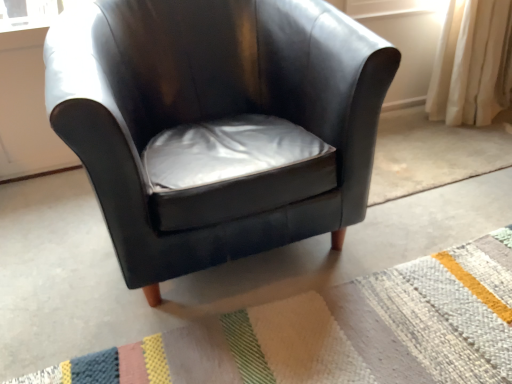
Question: Does textured woolen mat at lower right turn towards matte black armchair at center?

Choices:
 (A) no
 (B) yes

Answer: (A)

Question: Is textured woolen mat at lower right not close to matte black armchair at center?

Choices:
 (A) yes
 (B) no

Answer: (B)

Question: Considering the relative positions of textured woolen mat at lower right and matte black armchair at center in the image provided, is textured woolen mat at lower right to the left of matte black armchair at center from the viewer's perspective?

Choices:
 (A) yes
 (B) no

Answer: (B)

Question: Is textured woolen mat at lower right thinner than matte black armchair at center?

Choices:
 (A) no
 (B) yes

Answer: (A)

Question: Can you see textured woolen mat at lower right touching matte black armchair at center?

Choices:
 (A) no
 (B) yes

Answer: (A)

Question: Can you confirm if textured woolen mat at lower right is taller than matte black armchair at center?

Choices:
 (A) yes
 (B) no

Answer: (B)

Question: Can you confirm if matte black armchair at center is smaller than textured woolen mat at lower right?

Choices:
 (A) no
 (B) yes

Answer: (A)

Question: Is matte black armchair at center wider than textured woolen mat at lower right?

Choices:
 (A) yes
 (B) no

Answer: (B)

Question: Does matte black armchair at center touch textured woolen mat at lower right?

Choices:
 (A) yes
 (B) no

Answer: (B)

Question: Is the depth of matte black armchair at center less than that of textured woolen mat at lower right?

Choices:
 (A) no
 (B) yes

Answer: (A)

Question: Considering the relative sizes of matte black armchair at center and textured woolen mat at lower right in the image provided, is matte black armchair at center bigger than textured woolen mat at lower right?

Choices:
 (A) no
 (B) yes

Answer: (B)

Question: From the image's perspective, would you say matte black armchair at center is shown under textured woolen mat at lower right?

Choices:
 (A) no
 (B) yes

Answer: (A)

Question: Is point (214, 221) closer or farther from the camera than point (460, 339)?

Choices:
 (A) farther
 (B) closer

Answer: (B)